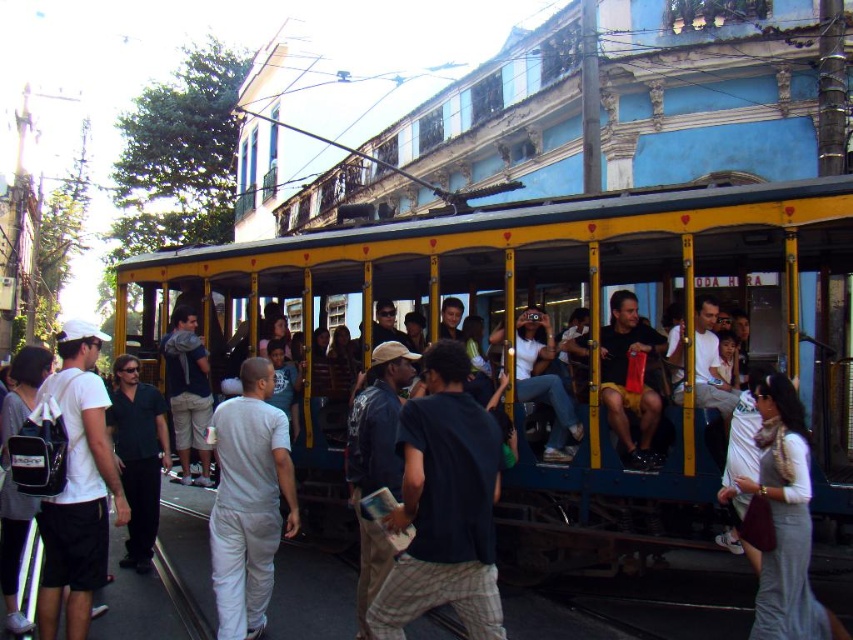
Question: Which object is farther from the camera taking this photo?

Choices:
 (A) black matte shirt at left
 (B) gray cotton shirt at center
 (C) light gray scarf at center
 (D) dark blue shirt at center

Answer: (A)

Question: Is dark blue shirt at center positioned behind gray cotton shirt at center?

Choices:
 (A) no
 (B) yes

Answer: (A)

Question: Is yellow painted metal trolley at center bigger than light gray scarf at center?

Choices:
 (A) yes
 (B) no

Answer: (A)

Question: Can you confirm if dark blue shirt at center is positioned to the right of matte black backpack at left?

Choices:
 (A) no
 (B) yes

Answer: (B)

Question: Which of the following is the farthest from the observer?

Choices:
 (A) (799, 451)
 (B) (149, 538)
 (C) (119, 284)

Answer: (C)

Question: Which object appears closest to the camera in this image?

Choices:
 (A) black matte shirt at left
 (B) light gray scarf at center

Answer: (B)